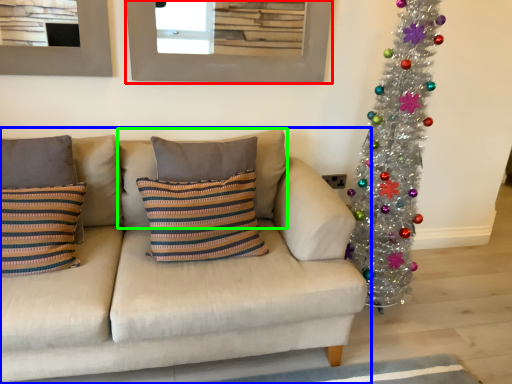
Question: Which object is positioned closest to picture frame (highlighted by a red box)? Select from studio couch (highlighted by a blue box) and pillow (highlighted by a green box).

Choices:
 (A) studio couch
 (B) pillow

Answer: (B)